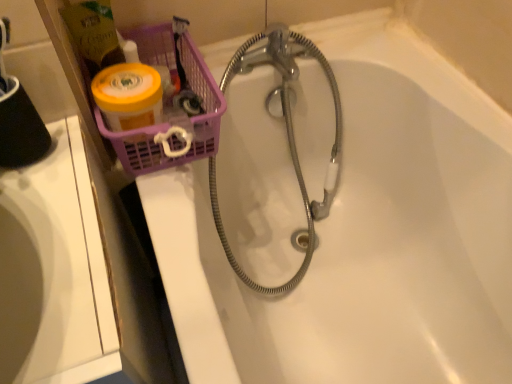
Question: Does white glossy sink at left come behind white glossy bathtub at upper center?

Choices:
 (A) no
 (B) yes

Answer: (A)

Question: Does white glossy sink at left have a larger size compared to white glossy bathtub at upper center?

Choices:
 (A) yes
 (B) no

Answer: (A)

Question: Is white glossy sink at left taller than white glossy bathtub at upper center?

Choices:
 (A) no
 (B) yes

Answer: (B)

Question: From a real-world perspective, does white glossy sink at left stand above white glossy bathtub at upper center?

Choices:
 (A) yes
 (B) no

Answer: (B)

Question: From the image's perspective, is white glossy sink at left located above white glossy bathtub at upper center?

Choices:
 (A) yes
 (B) no

Answer: (B)

Question: Is white glossy sink at left shorter than white glossy bathtub at upper center?

Choices:
 (A) no
 (B) yes

Answer: (A)

Question: From a real-world perspective, is white glossy bathtub at upper center physically above white glossy sink at left?

Choices:
 (A) no
 (B) yes

Answer: (B)

Question: Is white glossy bathtub at upper center looking in the opposite direction of white glossy sink at left?

Choices:
 (A) yes
 (B) no

Answer: (B)

Question: Can you confirm if white glossy bathtub at upper center is taller than white glossy sink at left?

Choices:
 (A) yes
 (B) no

Answer: (B)

Question: Considering the relative positions of white glossy bathtub at upper center and white glossy sink at left in the image provided, is white glossy bathtub at upper center to the left of white glossy sink at left from the viewer's perspective?

Choices:
 (A) yes
 (B) no

Answer: (B)

Question: From a real-world perspective, is white glossy bathtub at upper center below white glossy sink at left?

Choices:
 (A) no
 (B) yes

Answer: (A)

Question: From the image's perspective, is white glossy bathtub at upper center beneath white glossy sink at left?

Choices:
 (A) no
 (B) yes

Answer: (A)

Question: Does translucent plastic basket at upper left have a larger size compared to white glossy bathtub at upper center?

Choices:
 (A) yes
 (B) no

Answer: (B)